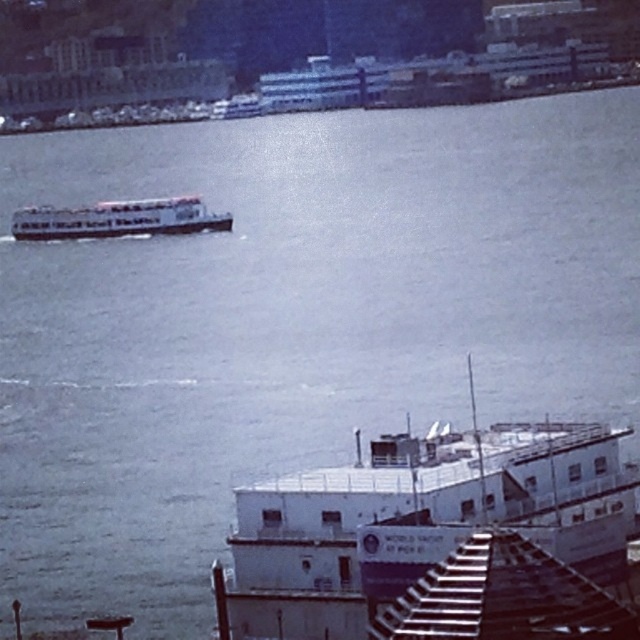
You are a photographer standing at the dock and want to capture both the white matte boat at lower right and the white matte boat at upper left in a single shot. Which boat should you position closer to the center of your camera frame to ensure both are visible without zooming in?

The white matte boat at lower right is wider than the white matte boat at upper left, so positioning the white matte boat at lower right closer to the center of your camera frame will ensure both are visible without zooming in.

You are standing on the dock and see the white matte boat at lower right and the white matte boat at upper left. Which boat is positioned more to the right side of the scene?

The white matte boat at lower right is positioned more to the right side of the scene than the white matte boat at upper left.

You are standing on the dock and want to throw a rope to both points in the water. The first point is at coordinates point (532, 474) and the second point is at point (97, 234). Which point is closer to you?

Point (532, 474) is closer to the viewer than point (97, 234), so you should aim for that point first.